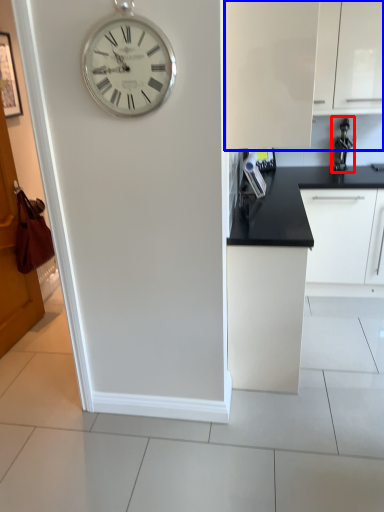
Question: Which of the following is the closest to the observer, appliance (highlighted by a red box) or cabinetry (highlighted by a blue box)?

Choices:
 (A) appliance
 (B) cabinetry

Answer: (B)